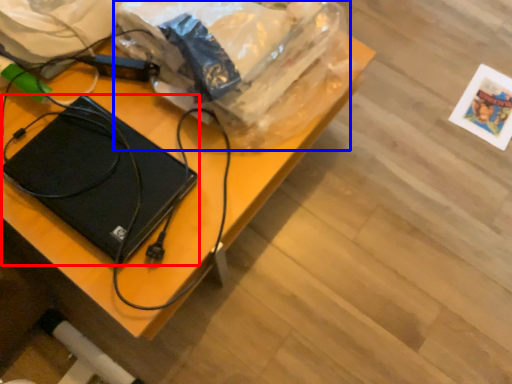
Question: Among these objects, which one is nearest to the camera, laptop (highlighted by a red box) or grocery bag (highlighted by a blue box)?

Choices:
 (A) laptop
 (B) grocery bag

Answer: (B)